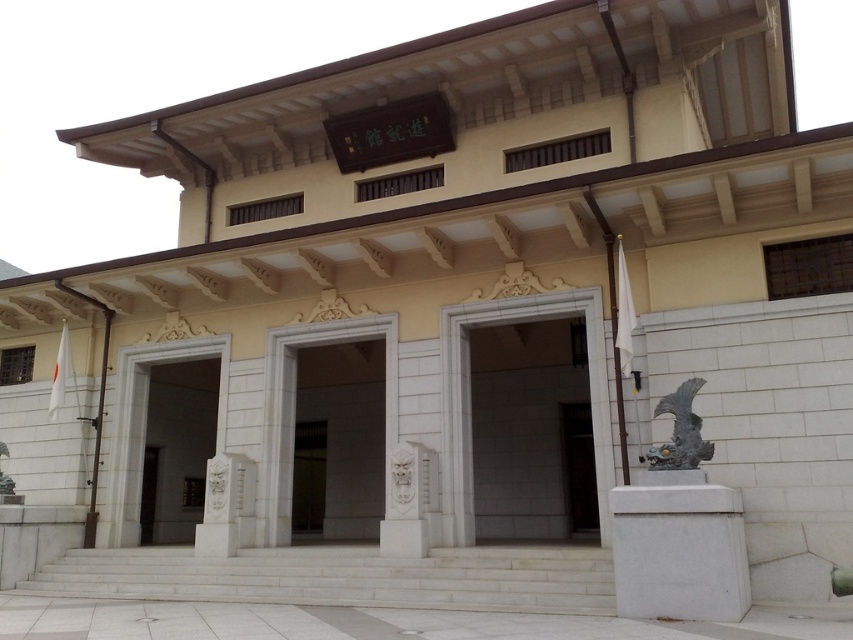
Question: Observing the image, what is the correct spatial positioning of white marble stairs at center in reference to white marble entrance at center?

Choices:
 (A) left
 (B) right

Answer: (B)

Question: Does white marble pillar at lower right appear on the left side of white marble entrance at center?

Choices:
 (A) no
 (B) yes

Answer: (A)

Question: Which object is farther from the camera taking this photo?

Choices:
 (A) white marble stairs at center
 (B) white marble pillar at lower right

Answer: (A)

Question: Which of the following is the closest to the observer?

Choices:
 (A) bronze fish at right
 (B) white marble stairs at center
 (C) white stone door at center

Answer: (A)

Question: In this image, where is white marble pillar at lower right located relative to white marble entrance at center?

Choices:
 (A) left
 (B) right

Answer: (B)

Question: Which of these objects is positioned farthest from the bronze fish at right?

Choices:
 (A) white marble entrance at center
 (B) white stone door at center

Answer: (B)